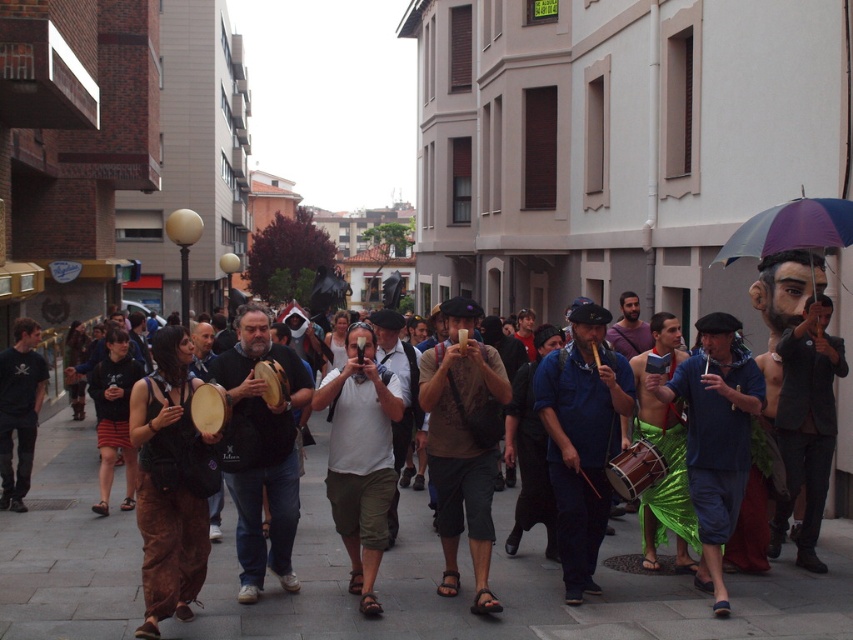
Question: Does shiny green skirt at center have a greater width compared to blue fabric pants at center?

Choices:
 (A) no
 (B) yes

Answer: (B)

Question: In this image, where is brown leather bag at center located relative to purple fabric umbrella at upper right?

Choices:
 (A) left
 (B) right

Answer: (A)

Question: Which object is positioned closest to the brown suede drum at center?

Choices:
 (A) brown leather bag at center
 (B) white matte camera at center

Answer: (B)

Question: Which object is positioned closest to the blue fabric pants at center?

Choices:
 (A) shiny green skirt at center
 (B) brown leather bag at center
 (C) brown suede drum at center
 (D) gray concrete pavement at center

Answer: (B)

Question: Can you confirm if gray concrete pavement at center is smaller than purple fabric umbrella at upper right?

Choices:
 (A) yes
 (B) no

Answer: (B)

Question: Considering the real-world distances, which object is closest to the white matte camera at center?

Choices:
 (A) brown leather bag at center
 (B) blue fabric pants at center
 (C) gray concrete pavement at center
 (D) shiny green skirt at center

Answer: (A)